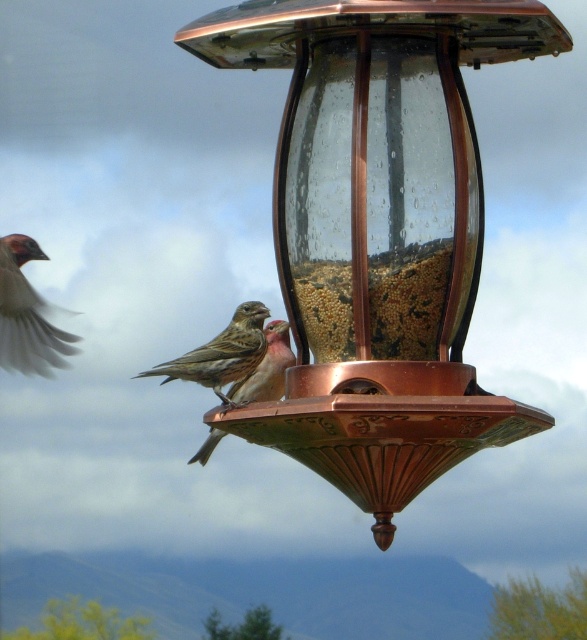
Question: In this image, where is brown matte sparrow at center located relative to brown speckled sparrow at center?

Choices:
 (A) left
 (B) right

Answer: (A)

Question: Which object is the farthest from the brown speckled sparrow at center?

Choices:
 (A) white matte sparrow at left
 (B) copper glass bird feeder at center

Answer: (B)

Question: Is brown matte sparrow at center below brown speckled sparrow at center?

Choices:
 (A) yes
 (B) no

Answer: (B)

Question: Which of the following is the farthest from the observer?

Choices:
 (A) brown speckled sparrow at center
 (B) copper glass bird feeder at center
 (C) white matte sparrow at left
 (D) brown matte sparrow at center

Answer: (C)

Question: Which point appears farthest from the camera in this image?

Choices:
 (A) (258, 310)
 (B) (11, 289)
 (C) (340, 388)
 (D) (245, 396)

Answer: (B)

Question: Can you confirm if white matte sparrow at left is positioned above brown matte sparrow at center?

Choices:
 (A) yes
 (B) no

Answer: (B)